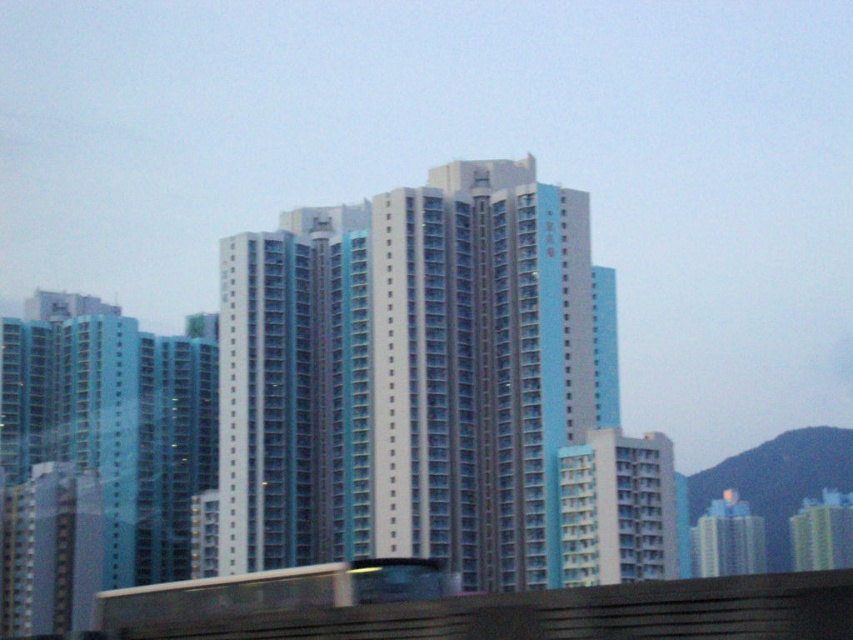
You are a city planner assessing the urban layout. You need to determine which object occupies more space in the image. Based on the scene, which one is larger in size between the white glass building at center and the concrete platform at lower center?

The white glass building at center is bigger than the concrete platform at lower center, so it occupies more space in the image.

You are a drone operator trying to land a drone on the concrete platform at lower center. The drone is currently above the white glass building at center. Which direction should you move the drone to reach the platform?

The white glass building at center is positioned on the left side of the concrete platform at lower center. Therefore, you should move the drone to the right to reach the platform.

You are standing in a park across from the white glass building at center. The park is 100 meters away from the building. If you want to take a photo of the building without any obstructions, can you do so from your current position?

The white glass building at center is 107.48 meters from viewer. Since the park is 100 meters away from the building, you are actually 7.48 meters closer to the building than the stated distance. However, the question states that you are in a park across from the building, which is 100 meters away. This implies that your current position is 100 meters from the building. Since 100 meters is less than 107.48 meters, you are within a range where you might still have an unobstructed view. However, the exact ob